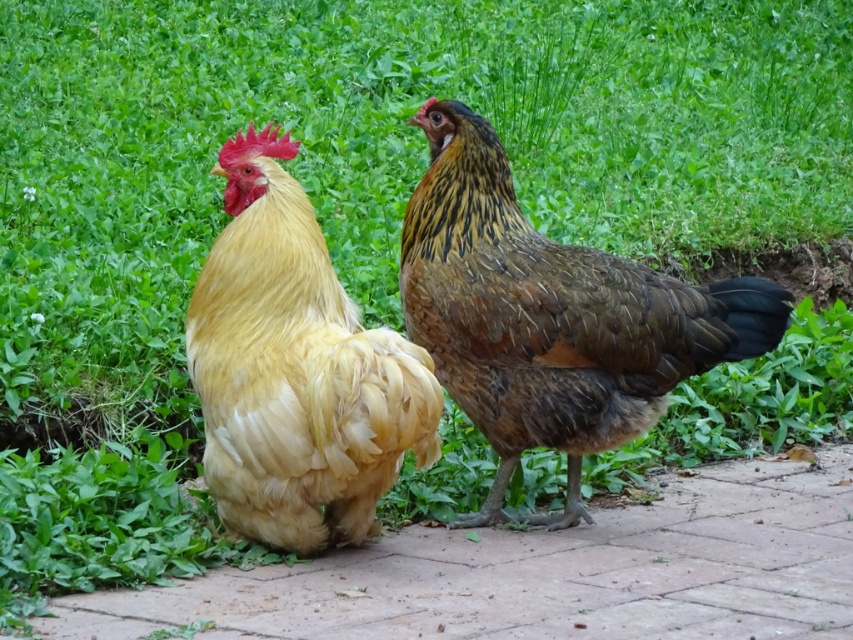
Measure the distance between brick pavement at lower center and brown speckled feathered chicken at center.

23.85 inches

Does brick pavement at lower center have a lesser height compared to brown speckled feathered chicken at center?

Correct, brick pavement at lower center is not as tall as brown speckled feathered chicken at center.

You are a GUI agent. You are given a task and a screenshot of the screen. Output one action in this format:
    pyautogui.click(x=<x>, y=<y>)
    Task: Click on the brick pavement at lower center
    The height and width of the screenshot is (640, 853).
    Given the screenshot: What is the action you would take?
    pyautogui.click(x=544, y=573)

Can you confirm if brown speckled feathered chicken at center is thinner than golden feathered rooster at center?

No.

Is brown speckled feathered chicken at center smaller than golden feathered rooster at center?

No, brown speckled feathered chicken at center is not smaller than golden feathered rooster at center.

Is point (521, 227) positioned behind point (328, 461)?

Yes, it is behind point (328, 461).

This screenshot has width=853, height=640. Find the location of `brown speckled feathered chicken at center`. brown speckled feathered chicken at center is located at coordinates (550, 317).

Where is `brick pavement at lower center`? The image size is (853, 640). brick pavement at lower center is located at coordinates [544, 573].

Can you confirm if brick pavement at lower center is positioned above golden feathered rooster at center?

No.

In order to click on brick pavement at lower center in this screenshot , I will do `click(544, 573)`.